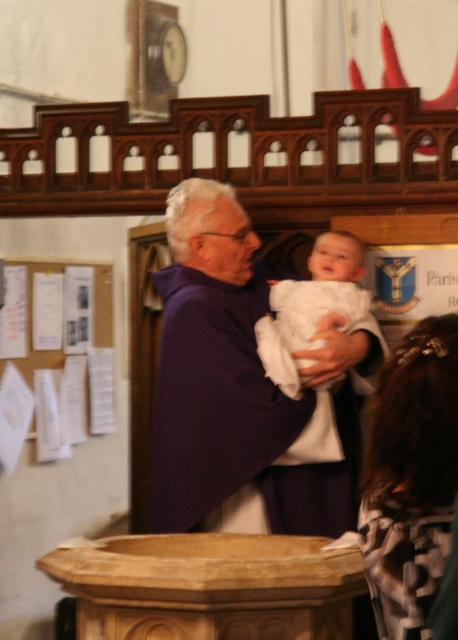
Based on the scene described, where is the purple clothed man at center located in terms of coordinates?

The purple clothed man at center is located at coordinates point [243,390].

You are attending a baptism ceremony in the church. You see the purple clothed man at center and the white clothed baby at center. Which one is bigger in size?

The purple clothed man at center is larger in size than the white clothed baby at center.